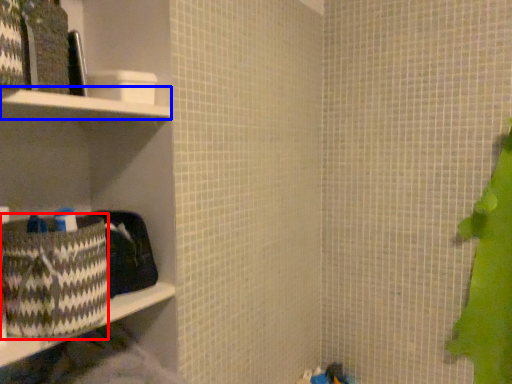
Question: Which of the following is the closest to the observer, waste (highlighted by a red box) or cabinet (highlighted by a blue box)?

Choices:
 (A) waste
 (B) cabinet

Answer: (B)